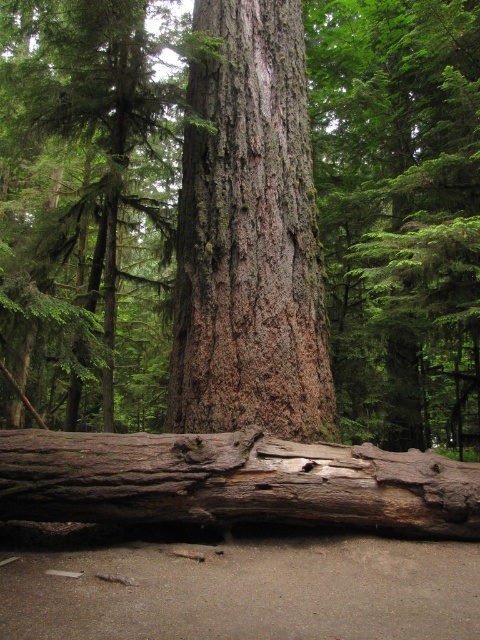
You are standing in the forest scene and want to walk from point A to point B. Point A is at coordinate point (299, 20), and point B is at coordinate point (411, 81). Which direction should you face to walk towards point B from point A?

To walk from point A at coordinate point (299, 20) to point B at coordinate point (411, 81), you should face towards the direction of the large weathered tree trunk in the foreground since point B is behind point A relative to the viewer.

You are a hiker standing in the forest scene. You notice two objects in front of you. One is the smooth brown bark at center and the other is the rough bark log at lower center. Which one is nearer to you?

The smooth brown bark at center is closer to the viewer than the rough bark log at lower center, so the smooth brown bark at center is nearer to you.